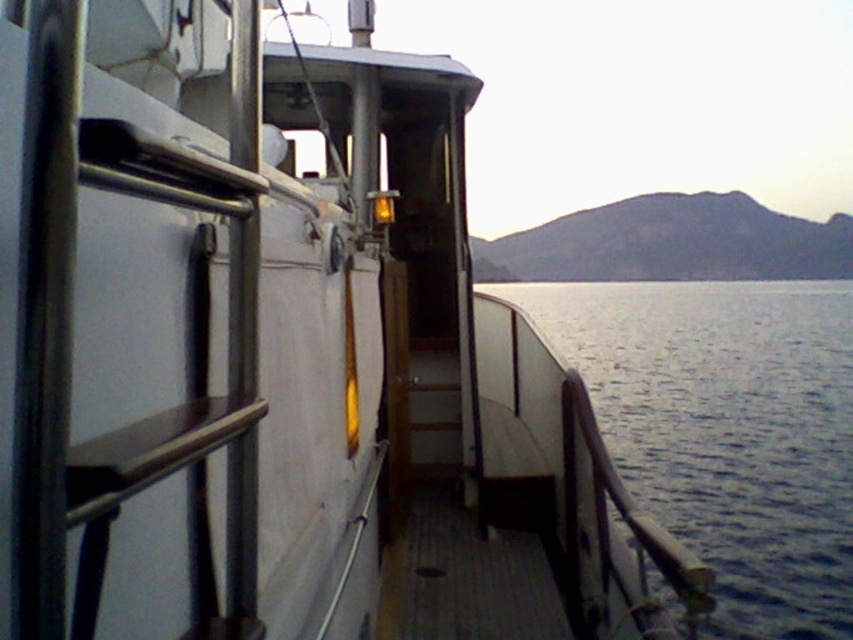
Between blue water at lower right and wooden at center, which one is positioned higher?

blue water at lower right is higher up.

How far apart are blue water at lower right and wooden at center?

They are 36.09 feet apart.

Describe the element at coordinates (727, 429) in the screenshot. This screenshot has width=853, height=640. I see `blue water at lower right` at that location.

Locate an element on the screen. The width and height of the screenshot is (853, 640). blue water at lower right is located at coordinates (727, 429).